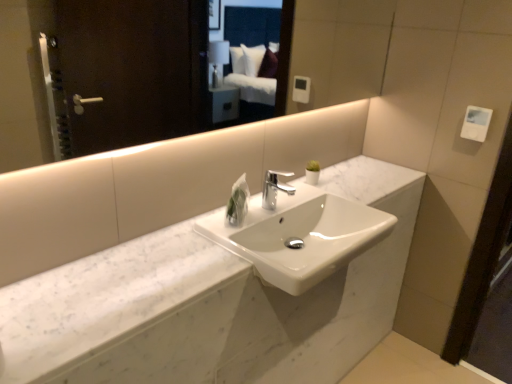
Find the location of a particular element. blank area beneath white glossy mirror at upper center (from a real-world perspective) is located at coordinates (204, 208).